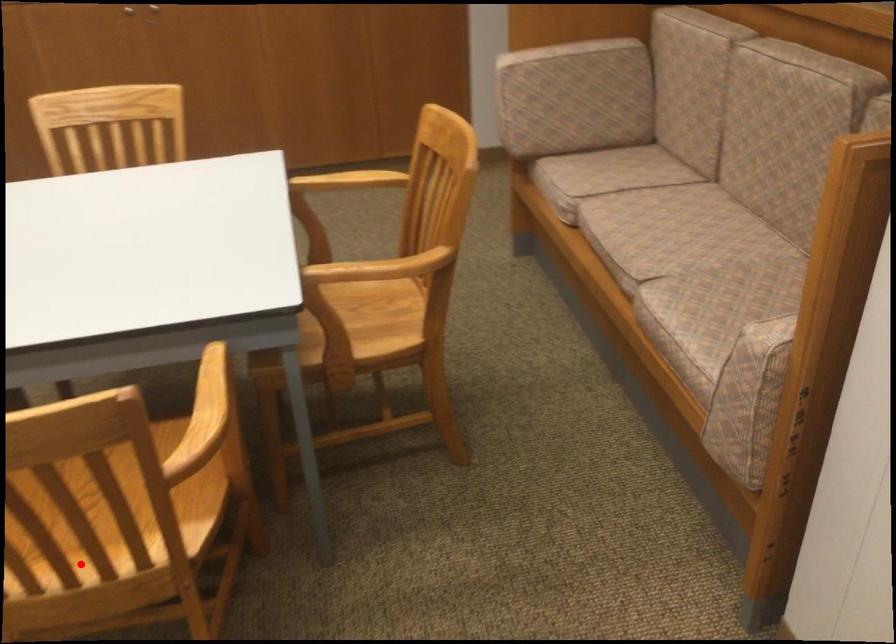
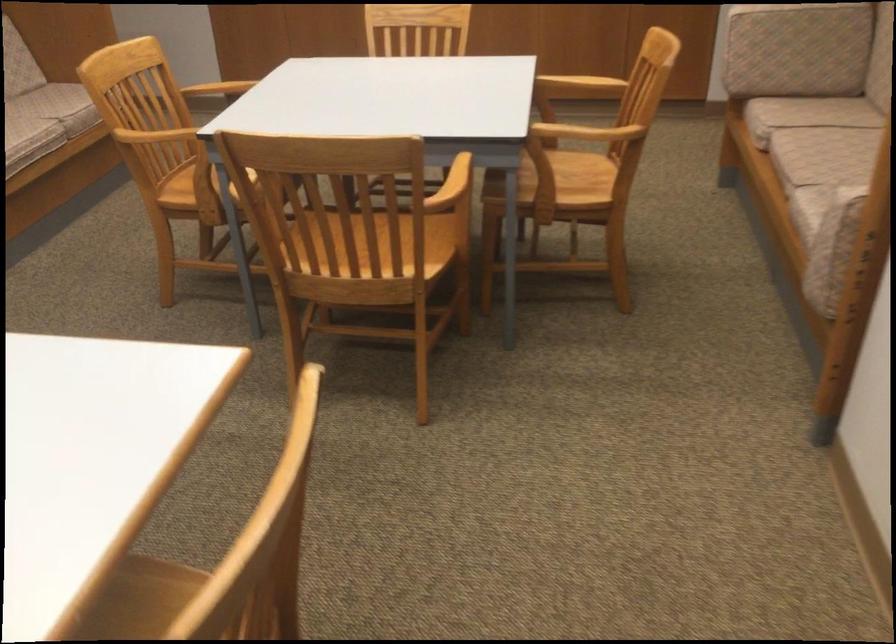
Question: I am providing you with two images of the same scene from different viewpoints. Image1 has a red point marked. In image2, the corresponding 3D location appears at what relative position? Reply with the corresponding letter.

Choices:
 (A) Closer
 (B) Farther

Answer: (B)